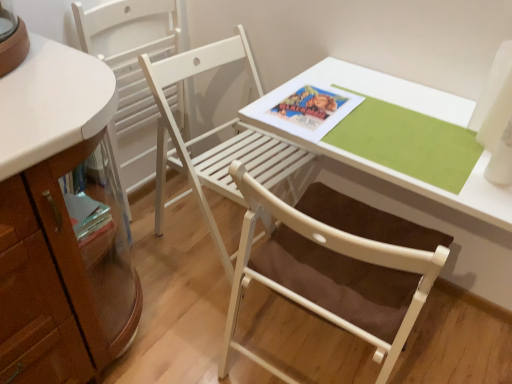
This screenshot has height=384, width=512. Identify the location of blank space situated above white wood table at center (from a real-world perspective). (378, 115).